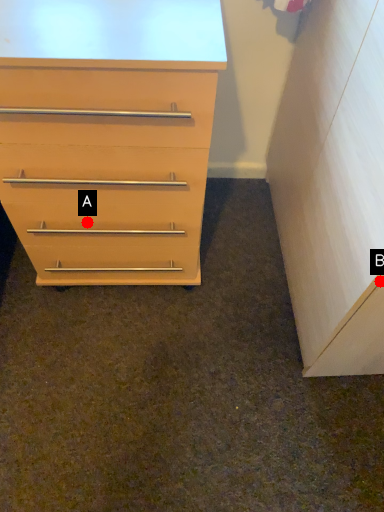
Question: Two points are circled on the image, labeled by A and B beside each circle. Which point appears farthest from the camera in this image?

Choices:
 (A) A is further
 (B) B is further

Answer: (A)